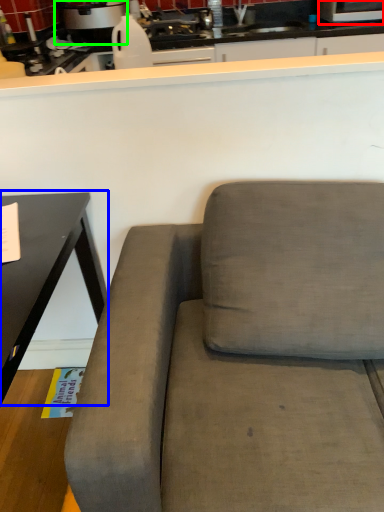
Question: Considering the real-world distances, which object is closest to appliance (highlighted by a red box)? table (highlighted by a blue box) or appliance (highlighted by a green box).

Choices:
 (A) table
 (B) appliance

Answer: (B)